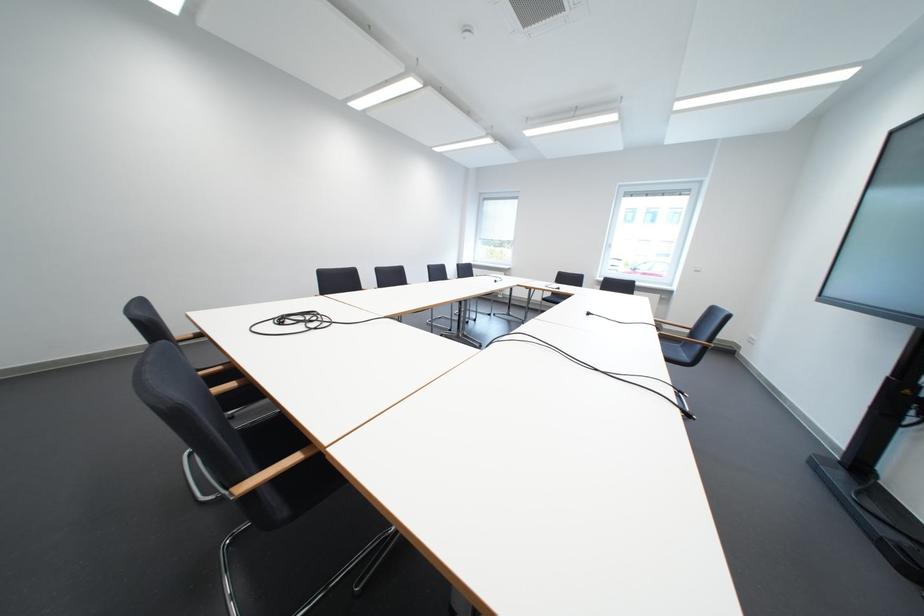
The height and width of the screenshot is (616, 924). In order to click on black chair sitting surface in this screenshot , I will do `click(266, 436)`.